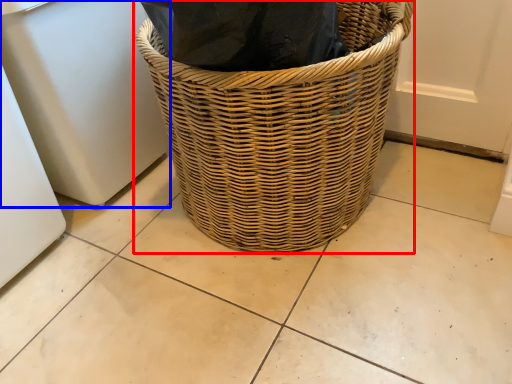
Question: Which object is further to the camera taking this photo, picnic basket (highlighted by a red box) or appliance (highlighted by a blue box)?

Choices:
 (A) picnic basket
 (B) appliance

Answer: (B)